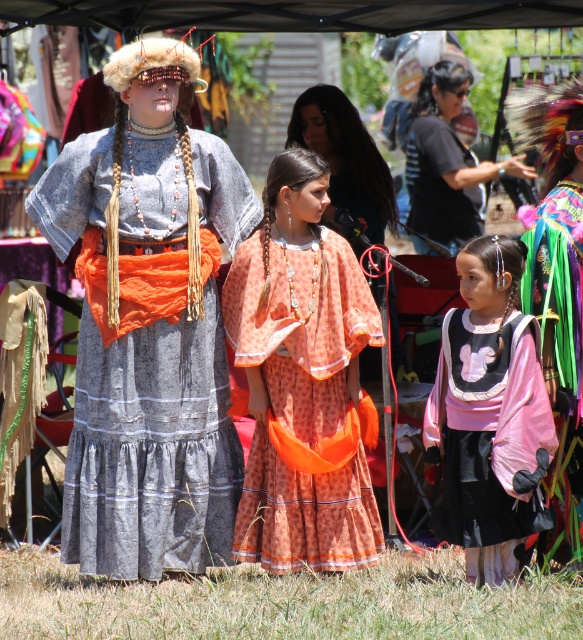
In the scene shown: You are a photographer at the festival and need to capture both the matte black shirt at upper center and the orange fabric dress at center in a single frame. Which object should you focus on first to ensure both are in the frame?

You should focus on the matte black shirt at upper center first because it is larger than the orange fabric dress at center, ensuring it fits within the frame while still capturing the smaller dress.

You are organizing a photo shoot and need to ensure that the two black shirts are visible in the frame. Given that the matte black shirt at upper center is wider than the black cotton shirt at upper center, which one should you focus on to ensure it fits within the camera frame if space is limited?

The matte black shirt at upper center is wider than the black cotton shirt at upper center, so you should focus on ensuring the matte black shirt at upper center fits within the camera frame first since it requires more space.

You are a photographer at this event and want to capture both the orange fabric dress at center and the black cotton shirt at upper center in a single frame. Based on their positions, which one will appear closer to the bottom of the photo?

The orange fabric dress at center is positioned under the black cotton shirt at upper center, so it will appear closer to the bottom of the photo.